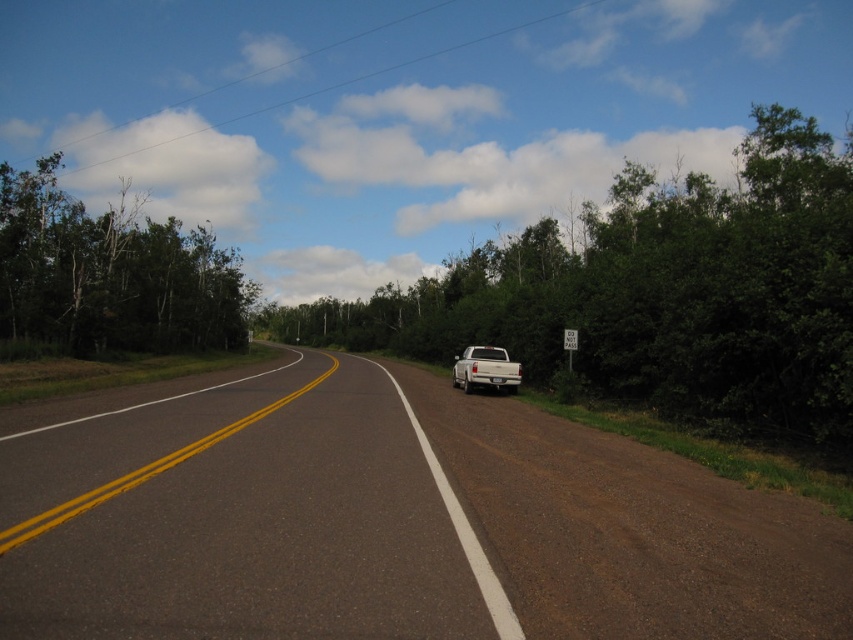
Between green leafy trees at left and white matte truck at center-right, which one appears on the right side from the viewer's perspective?

white matte truck at center-right is more to the right.

Does green leafy trees at left have a larger size compared to white matte truck at center-right?

Yes, green leafy trees at left is bigger than white matte truck at center-right.

Which is in front, point (24, 204) or point (469, 369)?

Point (469, 369) is more forward.

The width and height of the screenshot is (853, 640). I want to click on green leafy trees at left, so click(109, 275).

Between green leafy tree at right and white matte truck at center-right, which one has more height?

green leafy tree at right

Can you confirm if green leafy tree at right is smaller than white matte truck at center-right?

Incorrect, green leafy tree at right is not smaller in size than white matte truck at center-right.

Does point (491, 340) lie behind point (517, 372)?

That is True.

The height and width of the screenshot is (640, 853). Identify the location of green leafy tree at right. (659, 291).

Is green leafy tree at right thinner than green leafy trees at left?

In fact, green leafy tree at right might be wider than green leafy trees at left.

Who is more forward, (685, 294) or (178, 221)?

Point (685, 294) is in front.

What do you see at coordinates (659, 291) in the screenshot? I see `green leafy tree at right` at bounding box center [659, 291].

Where is `green leafy tree at right`? green leafy tree at right is located at coordinates (659, 291).